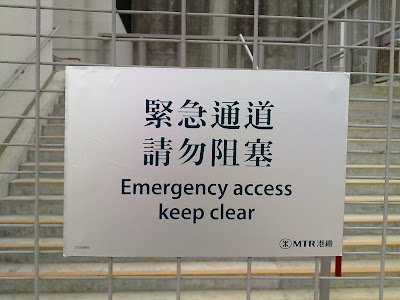
Where is `gray wall`? The image size is (400, 300). gray wall is located at coordinates (163, 19).